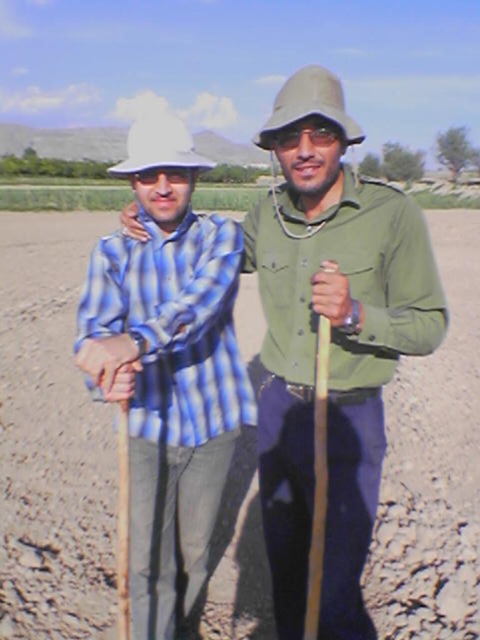
Question: Can you confirm if blue striped shirt at left is smaller than white matte hat at center?

Choices:
 (A) yes
 (B) no

Answer: (A)

Question: Does brown dirt track at center have a lesser width compared to green matte pith helmet at upper center?

Choices:
 (A) no
 (B) yes

Answer: (A)

Question: Does blue striped shirt at left lie behind white matte hat at center?

Choices:
 (A) no
 (B) yes

Answer: (A)

Question: Which point is closer to the camera?

Choices:
 (A) (164, 305)
 (B) (179, 124)
 (C) (313, 106)
 (D) (32, 532)

Answer: (C)

Question: Estimate the real-world distances between objects in this image. Which object is closer to the green matte pith helmet at upper center?

Choices:
 (A) white matte hat at center
 (B) brown dirt track at center
 (C) blue striped shirt at left

Answer: (A)

Question: Based on their relative distances, which object is nearer to the white matte hat at center?

Choices:
 (A) brown dirt track at center
 (B) green matte pith helmet at upper center
 (C) blue striped shirt at left

Answer: (B)